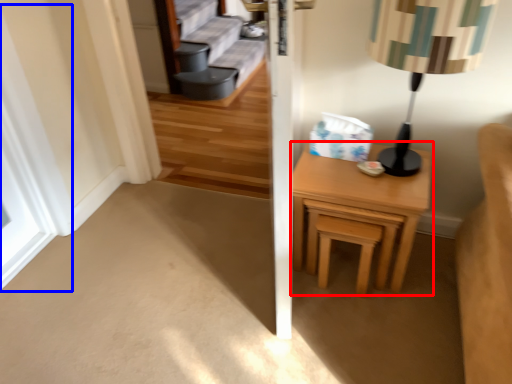
Question: Which of the following is the farthest to the observer, nightstand (highlighted by a red box) or window (highlighted by a blue box)?

Choices:
 (A) nightstand
 (B) window

Answer: (B)